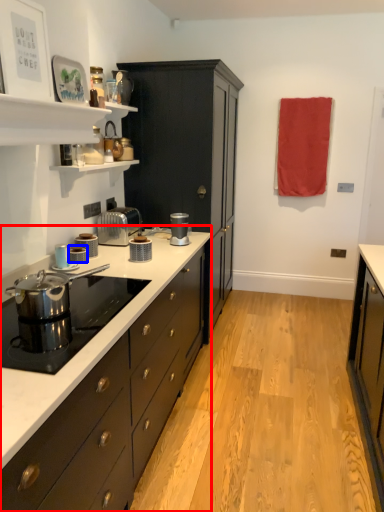
Question: Which object is further to the camera taking this photo, countertop (highlighted by a red box) or kitchen appliance (highlighted by a blue box)?

Choices:
 (A) countertop
 (B) kitchen appliance

Answer: (B)